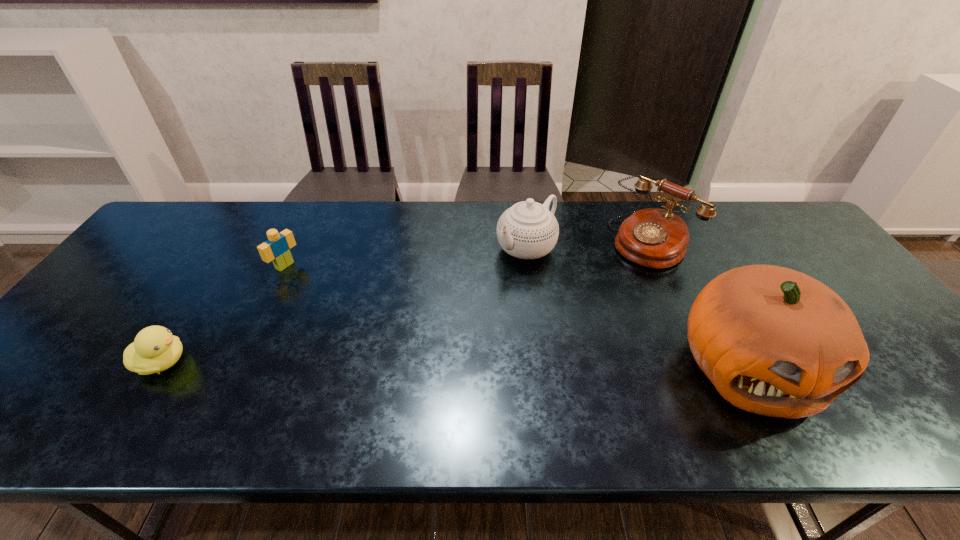
Find the location of a particular element. Image resolution: width=960 pixels, height=540 pixels. the leftmost object is located at coordinates (155, 349).

At what (x,y) coordinates should I click in order to perform the action: click on duckling. Please return your answer as a coordinate pair (x, y). Looking at the image, I should click on (155, 349).

The height and width of the screenshot is (540, 960). What are the coordinates of `the tallest object` in the screenshot? It's located at 776,342.

Where is `chinaware`? chinaware is located at coordinates (528, 230).

Where is `the fourth object from right to left`? The image size is (960, 540). the fourth object from right to left is located at coordinates (276, 249).

In order to click on telephone in this screenshot , I will do `click(656, 238)`.

Identify the location of vacant space located 0.380m at the beak of the shortest object. (352, 362).

Image resolution: width=960 pixels, height=540 pixels. In order to click on free spot located 0.050m on the spout of the chinaware in this screenshot , I will do `click(495, 272)`.

In order to click on blank space located 0.360m on the spout of the chinaware in this screenshot , I will do `click(412, 334)`.

Where is `vacant space situated on the spout of the chinaware`? vacant space situated on the spout of the chinaware is located at coordinates (442, 312).